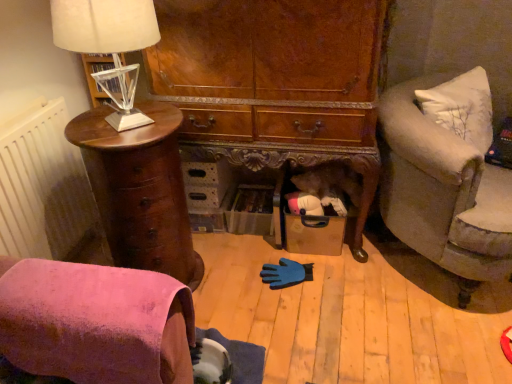
Question: Should I look upward or downward to see pink suede chair at lower left?

Choices:
 (A) down
 (B) up

Answer: (A)

Question: Is white textured radiator at left positioned behind white fabric lampshade at left?

Choices:
 (A) yes
 (B) no

Answer: (A)

Question: From a real-world perspective, does white textured radiator at left stand above white fabric lampshade at left?

Choices:
 (A) yes
 (B) no

Answer: (B)

Question: Is white textured radiator at left looking in the opposite direction of white fabric lampshade at left?

Choices:
 (A) no
 (B) yes

Answer: (A)

Question: Considering the relative sizes of white textured radiator at left and white fabric lampshade at left in the image provided, is white textured radiator at left thinner than white fabric lampshade at left?

Choices:
 (A) yes
 (B) no

Answer: (A)

Question: From the image's perspective, is white textured radiator at left under white fabric lampshade at left?

Choices:
 (A) yes
 (B) no

Answer: (A)

Question: Is white textured radiator at left shorter than white fabric lampshade at left?

Choices:
 (A) yes
 (B) no

Answer: (B)

Question: Can you confirm if velvet gray couch at right is smaller than white textured radiator at left?

Choices:
 (A) no
 (B) yes

Answer: (A)

Question: Is velvet gray couch at right behind white textured radiator at left?

Choices:
 (A) yes
 (B) no

Answer: (B)

Question: Is velvet gray couch at right thinner than white textured radiator at left?

Choices:
 (A) no
 (B) yes

Answer: (A)

Question: Can you confirm if velvet gray couch at right is taller than white textured radiator at left?

Choices:
 (A) no
 (B) yes

Answer: (A)

Question: Can you confirm if velvet gray couch at right is bigger than white textured radiator at left?

Choices:
 (A) no
 (B) yes

Answer: (B)

Question: Is velvet gray couch at right in contact with white textured radiator at left?

Choices:
 (A) yes
 (B) no

Answer: (B)

Question: From the image's perspective, is mahogany wood chest of drawers at left beneath velvet gray couch at right?

Choices:
 (A) no
 (B) yes

Answer: (B)